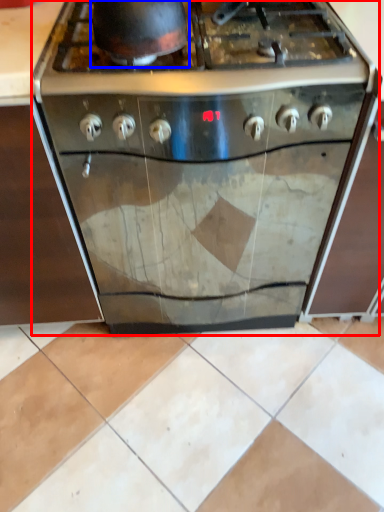
Question: Which object appears closest to the camera in this image, kitchen appliance (highlighted by a red box) or wok (highlighted by a blue box)?

Choices:
 (A) kitchen appliance
 (B) wok

Answer: (B)